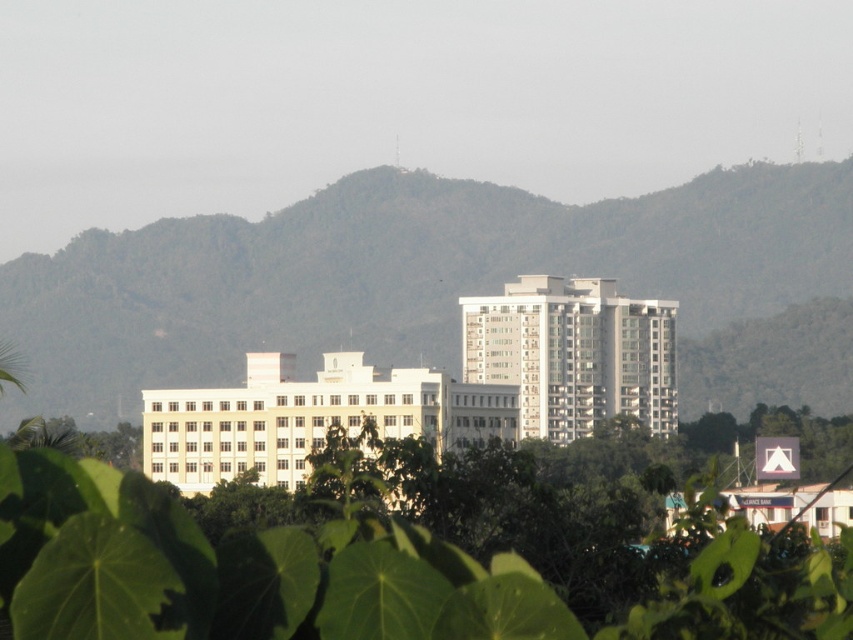
Where is `green leafy mountain at center`? Image resolution: width=853 pixels, height=640 pixels. green leafy mountain at center is located at coordinates (402, 275).

Looking at this image, between green leafy mountain at center and green leafy tree at center, which one is positioned higher?

Positioned higher is green leafy mountain at center.

Is point (608, 275) farther from camera compared to point (166, 609)?

Yes, it is behind point (166, 609).

Identify the location of green leafy mountain at center. Image resolution: width=853 pixels, height=640 pixels. (402, 275).